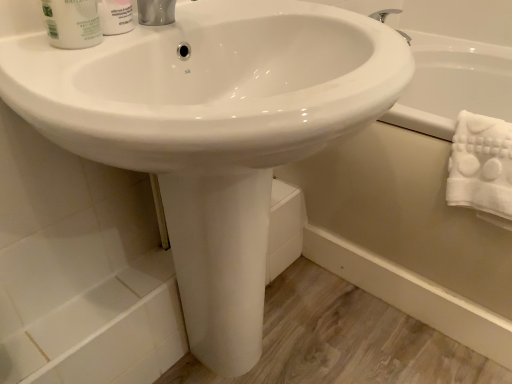
Image resolution: width=512 pixels, height=384 pixels. What do you see at coordinates (72, 23) in the screenshot?
I see `white glossy mouthwash at upper left` at bounding box center [72, 23].

Locate an element on the screen. The image size is (512, 384). white matte shaving cream at upper left is located at coordinates (115, 16).

The image size is (512, 384). Identify the location of white glossy bathtub at lower right. (421, 187).

Is white matte shaving cream at upper left bigger or smaller than white glossy mouthwash at upper left?

Clearly, white matte shaving cream at upper left is smaller in size than white glossy mouthwash at upper left.

Can white glossy mouthwash at upper left be found inside white matte shaving cream at upper left?

No, white glossy mouthwash at upper left is not inside white matte shaving cream at upper left.

Does white matte shaving cream at upper left appear on the left side of white glossy mouthwash at upper left?

No, white matte shaving cream at upper left is not to the left of white glossy mouthwash at upper left.

From the picture: Between white matte shaving cream at upper left and white fluffy towel at right, which one is positioned in front?

white matte shaving cream at upper left.

Based on the photo, which of these two, white matte shaving cream at upper left or white fluffy towel at right, is bigger?

white fluffy towel at right.

Is white matte shaving cream at upper left taller or shorter than white fluffy towel at right?

Clearly, white matte shaving cream at upper left is shorter compared to white fluffy towel at right.

From a real-world perspective, which object stands above the other?

white matte shaving cream at upper left, from a real-world perspective.

From the image's perspective, which object appears higher, white fluffy towel at right or white matte shaving cream at upper left?

white matte shaving cream at upper left is shown above in the image.

What's the angular difference between white fluffy towel at right and white matte shaving cream at upper left's facing directions?

The facing directions of white fluffy towel at right and white matte shaving cream at upper left are 88.5 degrees apart.

Is white fluffy towel at right located outside white matte shaving cream at upper left?

white fluffy towel at right is positioned outside white matte shaving cream at upper left.

Consider the image. From the image's perspective, which one is positioned lower, white glossy mouthwash at upper left or white matte shaving cream at upper left?

white glossy mouthwash at upper left appears lower in the image.

Who is smaller, white glossy mouthwash at upper left or white matte shaving cream at upper left?

With smaller size is white matte shaving cream at upper left.

Locate an element on the screen. Image resolution: width=512 pixels, height=384 pixels. mouthwash on the left of white matte shaving cream at upper left is located at coordinates (72, 23).

Between white glossy bathtub at lower right and white matte shaving cream at upper left, which one is positioned behind?

white glossy bathtub at lower right.

Does white glossy bathtub at lower right have a larger size compared to white matte shaving cream at upper left?

Yes.

Between white glossy bathtub at lower right and white matte shaving cream at upper left, which one has larger width?

Wider between the two is white glossy bathtub at lower right.

This screenshot has height=384, width=512. In order to click on shaving cream on the left of white glossy bathtub at lower right in this screenshot , I will do `click(115, 16)`.

From a real-world perspective, is white fluffy towel at right positioned above or below white glossy bathtub at lower right?

In terms of real-world spatial position, white fluffy towel at right is above white glossy bathtub at lower right.

Between white fluffy towel at right and white glossy bathtub at lower right, which one has less height?

white fluffy towel at right.

Is white fluffy towel at right bigger or smaller than white glossy bathtub at lower right?

In the image, white fluffy towel at right appears to be smaller than white glossy bathtub at lower right.

Could you tell me if white glossy bathtub at lower right is facing white glossy mouthwash at upper left?

No, white glossy bathtub at lower right is not facing towards white glossy mouthwash at upper left.

This screenshot has height=384, width=512. What are the coordinates of `bath lying behind the white glossy mouthwash at upper left` in the screenshot? It's located at (421, 187).

Which point is more forward, [395,226] or [58,30]?

The point [58,30] is in front.

From the image's perspective, is white glossy bathtub at lower right located above or below white glossy mouthwash at upper left?

From the image's perspective, white glossy bathtub at lower right appears below white glossy mouthwash at upper left.

At what (x,y) coordinates should I click in order to perform the action: click on mouthwash in front of the white matte shaving cream at upper left. Please return your answer as a coordinate pair (x, y). Looking at the image, I should click on (72, 23).

Identify the location of bath towel on the right of white matte shaving cream at upper left. (482, 168).

When comparing their distances from white glossy mouthwash at upper left, does white fluffy towel at right or white glossy bathtub at lower right seem further?

white glossy bathtub at lower right lies further to white glossy mouthwash at upper left than the other object.

Which object lies further to the anchor point white glossy bathtub at lower right, white matte shaving cream at upper left or white fluffy towel at right?

The object further to white glossy bathtub at lower right is white matte shaving cream at upper left.

From the image, which object appears to be farther from white fluffy towel at right, white glossy bathtub at lower right or white glossy mouthwash at upper left?

white glossy mouthwash at upper left.

Looking at the image, which one is located closer to white glossy mouthwash at upper left, white fluffy towel at right or white matte shaving cream at upper left?

white matte shaving cream at upper left.

Estimate the real-world distances between objects in this image. Which object is further from white matte shaving cream at upper left, white glossy mouthwash at upper left or white glossy bathtub at lower right?

Based on the image, white glossy bathtub at lower right appears to be further to white matte shaving cream at upper left.

From the picture: Considering their positions, is white glossy bathtub at lower right positioned closer to white fluffy towel at right than white matte shaving cream at upper left?

white glossy bathtub at lower right lies closer to white fluffy towel at right than the other object.

Based on the photo, from the image, which object appears to be nearer to white fluffy towel at right, white matte shaving cream at upper left or white glossy mouthwash at upper left?

white matte shaving cream at upper left lies closer to white fluffy towel at right than the other object.

Based on their spatial positions, is white glossy mouthwash at upper left or white fluffy towel at right further from white matte shaving cream at upper left?

The object further to white matte shaving cream at upper left is white fluffy towel at right.

The width and height of the screenshot is (512, 384). I want to click on shaving cream between white glossy mouthwash at upper left and white fluffy towel at right in the horizontal direction, so click(x=115, y=16).

Where is `bath towel situated between white glossy mouthwash at upper left and white glossy bathtub at lower right from left to right`? The height and width of the screenshot is (384, 512). bath towel situated between white glossy mouthwash at upper left and white glossy bathtub at lower right from left to right is located at coordinates (482, 168).

This screenshot has width=512, height=384. In order to click on shaving cream located between white glossy mouthwash at upper left and white glossy bathtub at lower right in the left-right direction in this screenshot , I will do coord(115,16).

You are a GUI agent. You are given a task and a screenshot of the screen. Output one action in this format:
    pyautogui.click(x=<x>, y=<y>)
    Task: Click on the bath towel situated between white matte shaving cream at upper left and white glossy bathtub at lower right from left to right
    The width and height of the screenshot is (512, 384).
    Given the screenshot: What is the action you would take?
    pyautogui.click(x=482, y=168)